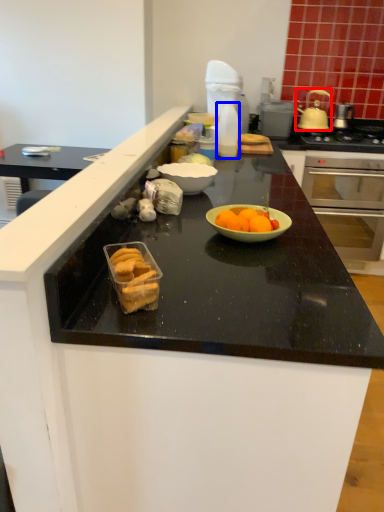
Question: Which of the following is the closest to the observer, pot/pan (highlighted by a red box) or bottle (highlighted by a blue box)?

Choices:
 (A) pot/pan
 (B) bottle

Answer: (B)